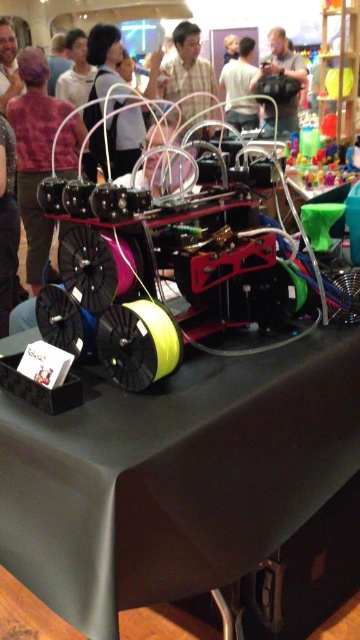
Is pink fabric at left bigger than light brown hair at upper left?

Incorrect, pink fabric at left is not larger than light brown hair at upper left.

Between point (14, 134) and point (2, 76), which one is positioned in front?

Point (14, 134)

Identify the location of pink fabric at left. (7, 225).

Who is lower down, black matte table at center or white matte shirt at upper center?

black matte table at center is below.

Between point (321, 428) and point (236, 58), which one is positioned in front?

Positioned in front is point (321, 428).

Locate an element on the screen. The image size is (360, 640). black matte table at center is located at coordinates (174, 477).

Does matte purple shirt at upper left appear over plaid shirt at center?

Actually, matte purple shirt at upper left is below plaid shirt at center.

You are a GUI agent. You are given a task and a screenshot of the screen. Output one action in this format:
    pyautogui.click(x=<x>, y=<y>)
    Task: Click on the matte purple shirt at upper left
    
    Given the screenshot: What is the action you would take?
    pyautogui.click(x=34, y=154)

In order to click on matte purple shirt at upper left in this screenshot , I will do `click(34, 154)`.